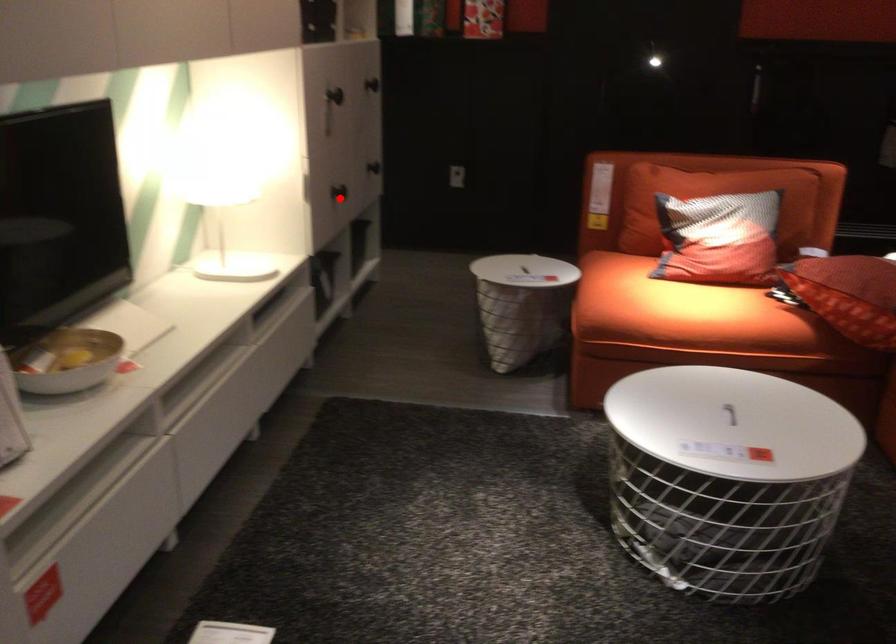
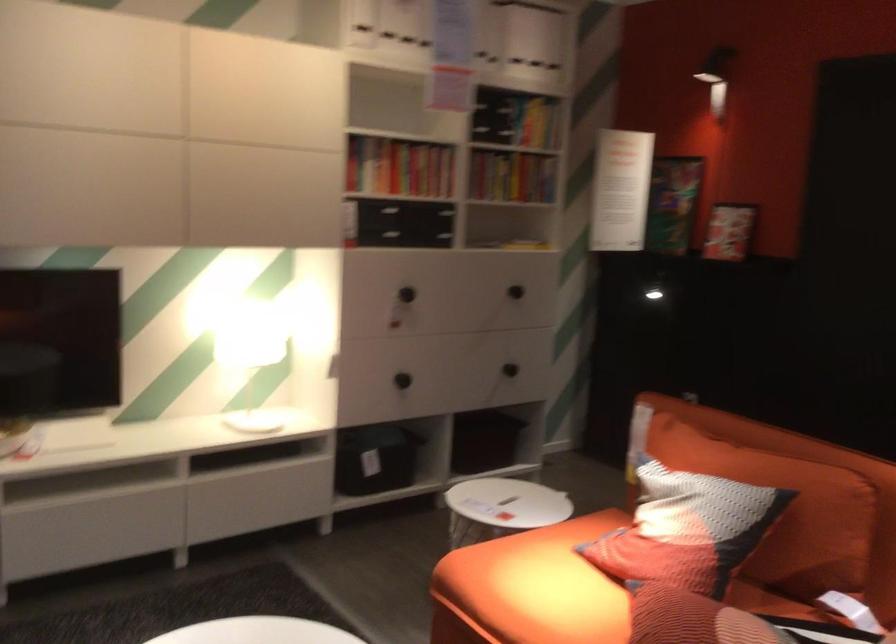
Find the pixel in the second image that matches the highlighted location in the first image.

(401, 380)